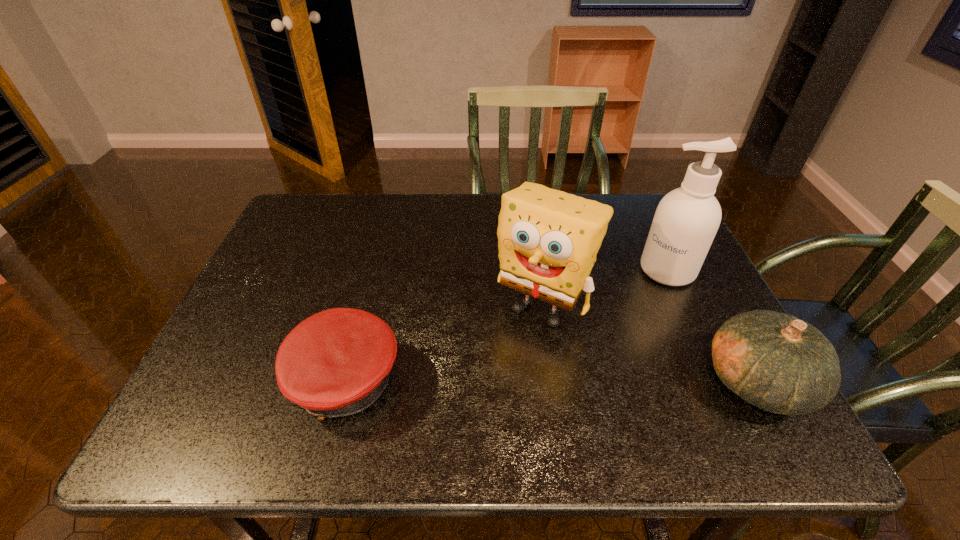
The width and height of the screenshot is (960, 540). Identify the location of free space that satisfies the following two spatial constraints: 1. on the front side of the tallest object; 2. on the right side of the third tallest object. (719, 382).